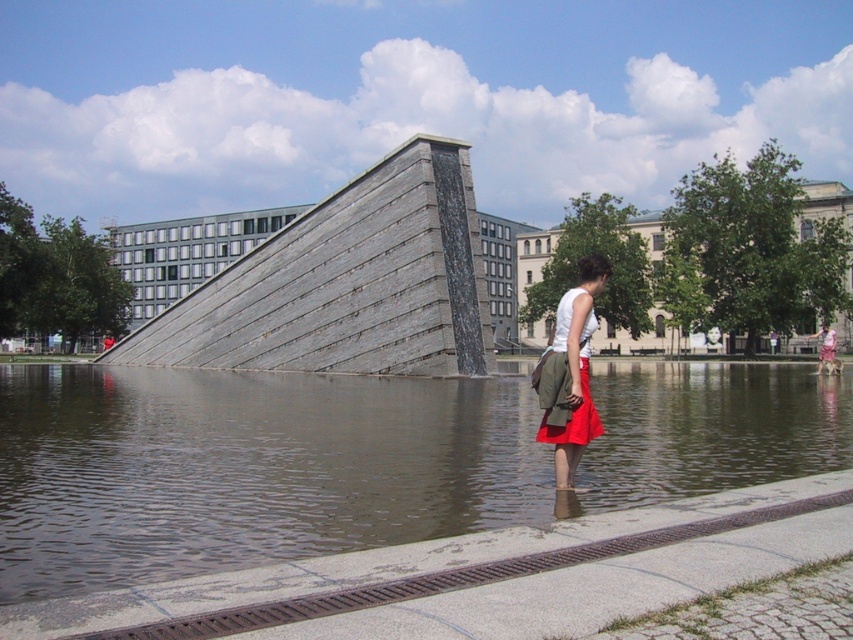
Question: Considering the real-world distances, which object is farthest from the gray stone pyramid at center?

Choices:
 (A) brown water at center
 (B) matte khaki shorts at center

Answer: (B)

Question: Can you confirm if brown water at center is positioned above gray stone pyramid at center?

Choices:
 (A) yes
 (B) no

Answer: (B)

Question: Which point is closer to the camera taking this photo?

Choices:
 (A) (570, 317)
 (B) (99, 545)

Answer: (B)

Question: Is brown water at center wider than gray stone pyramid at center?

Choices:
 (A) no
 (B) yes

Answer: (B)

Question: Which object appears closest to the camera in this image?

Choices:
 (A) brown water at center
 (B) gray stone pyramid at center
 (C) matte khaki shorts at center

Answer: (A)

Question: Considering the relative positions of brown water at center and matte khaki shorts at center in the image provided, where is brown water at center located with respect to matte khaki shorts at center?

Choices:
 (A) below
 (B) above

Answer: (A)